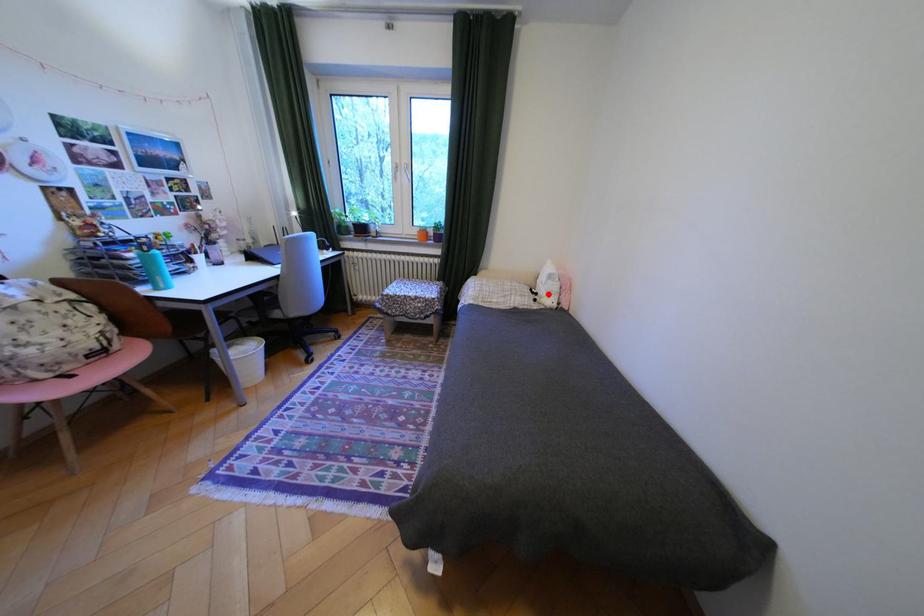
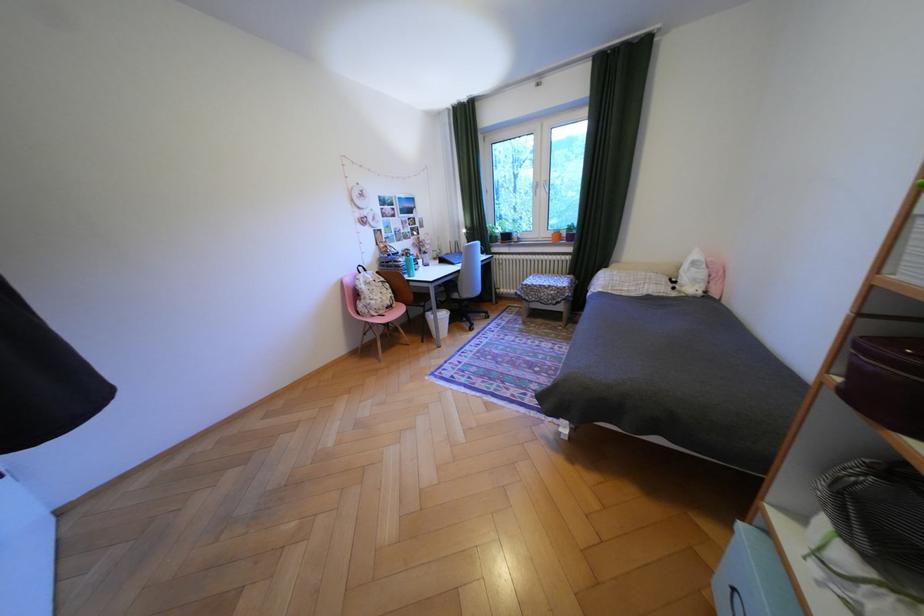
The point at the highlighted location is marked in the first image. Where is the corresponding point in the second image?

(687, 282)